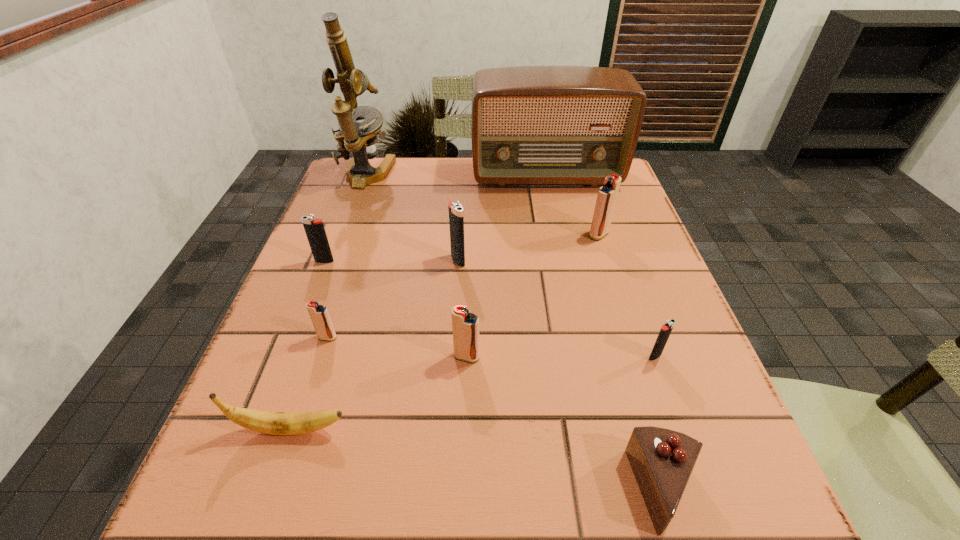
At what (x,y) coordinates should I click in order to perform the action: click on vacant space that satisfies the following two spatial constraints: 1. on the front-facing side of the ninth shortest object; 2. on the left side of the farthest igniter. Please return your answer as a coordinate pair (x, y). Looking at the image, I should click on (558, 234).

This screenshot has height=540, width=960. What are the coordinates of `free spot that satisfies the following two spatial constraints: 1. on the peel of the banana from the top; 2. on the back side of the chocolate cake` in the screenshot? It's located at (271, 490).

I want to click on free space that satisfies the following two spatial constraints: 1. on the front side of the tallest object; 2. on the right side of the nearest object, so click(251, 490).

Locate an element on the screen. The width and height of the screenshot is (960, 540). free point that satisfies the following two spatial constraints: 1. on the front-facing side of the second tallest object; 2. on the right side of the farthest red igniter is located at coordinates (558, 234).

Where is `free location that satisfies the following two spatial constraints: 1. on the front-facing side of the radio receiver; 2. on the right side of the nearest object`? The width and height of the screenshot is (960, 540). free location that satisfies the following two spatial constraints: 1. on the front-facing side of the radio receiver; 2. on the right side of the nearest object is located at coordinates (612, 490).